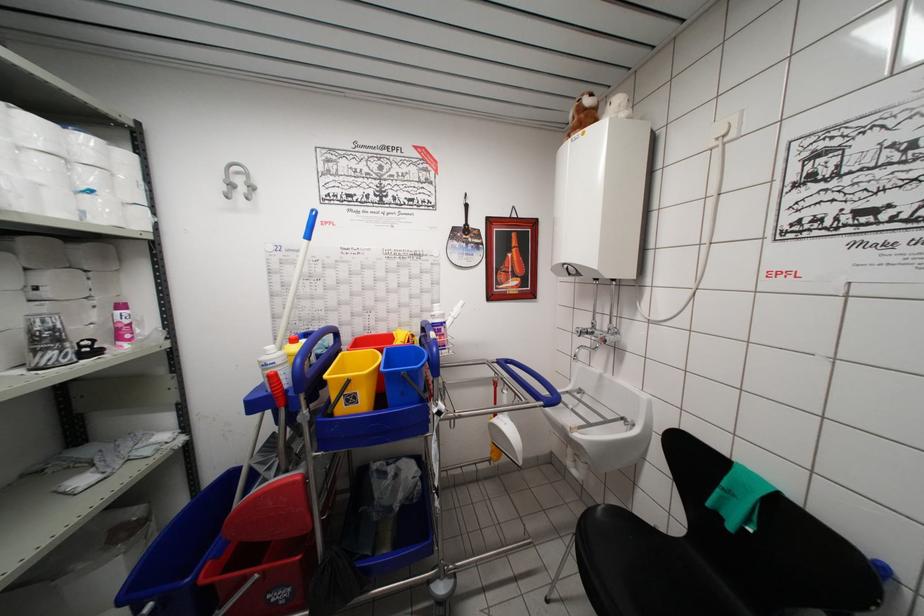
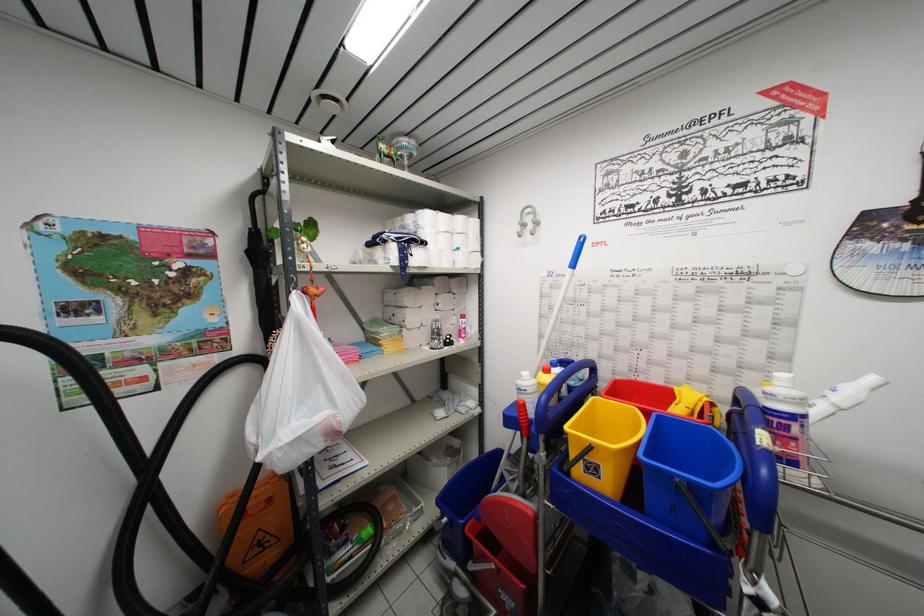
Find the pixel in the second image that matches point 416,339 in the first image.

(715, 408)